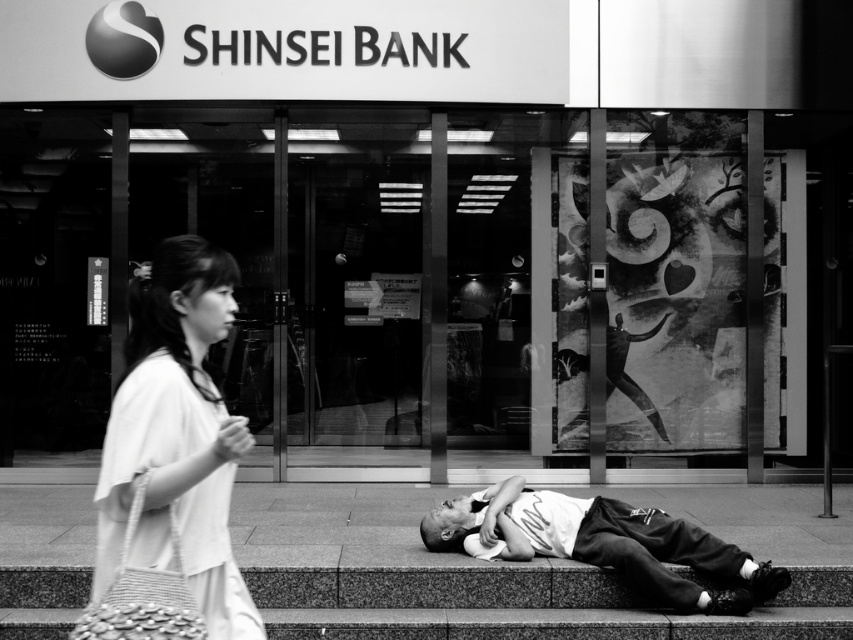
From the picture: You are a delivery person trying to place a large package on the ground. The package is wider than the white cotton shirt at lower center. Can you fit the package on the granite pavement at lower center without overlapping the shirt?

The granite pavement at lower center might be wider than the white cotton shirt at lower center, so there is a possibility that the package could fit if the pavement provides sufficient space. However, the exact dimensions are uncertain based on the description provided.

You are a delivery person who needs to place a small package on either the white fabric bag at left or the white cotton shirt at lower center. Based on their sizes, which object can fit the package more appropriately?

The white fabric bag at left is smaller than the white cotton shirt at lower center, so the white cotton shirt at lower center can fit the package more appropriately.